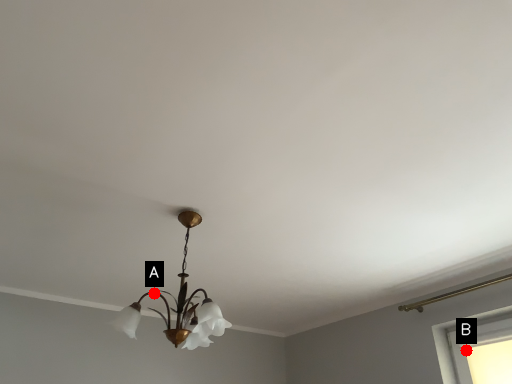
Question: Two points are circled on the image, labeled by A and B beside each circle. Which point is farther to the camera?

Choices:
 (A) A is further
 (B) B is further

Answer: (B)